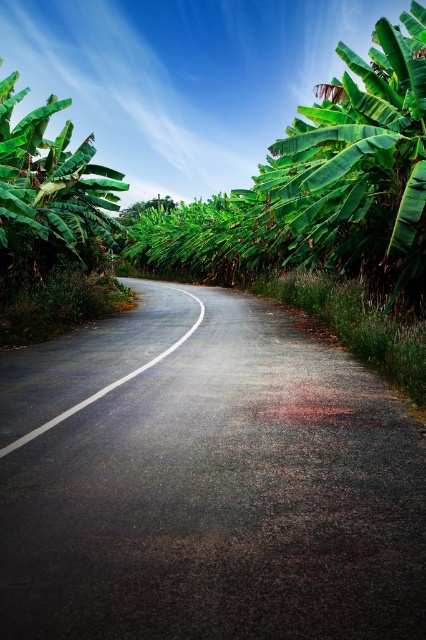
You are standing at the camera position and want to reach the point marked at coordinates (414, 241). If your walking speed is 3 feet per second, how many seconds will it take you to reach that point?

The distance of point (414, 241) from camera is 36.79 feet. At a walking speed of 3 feet per second, it will take 36.79 divided by 3, which is approximately 12.26 seconds. So, it will take about 12.26 seconds to reach the point.

You are a gardener planning to plant a new tree in this tropical landscape. You have a limited space and want to know which tree between the green leafy banana tree at left and the green leafy tree at center would be better suited for a smaller area. Which one should you choose?

The green leafy banana tree at left occupies less space than the green leafy tree at center, so it would be better suited for a smaller area.